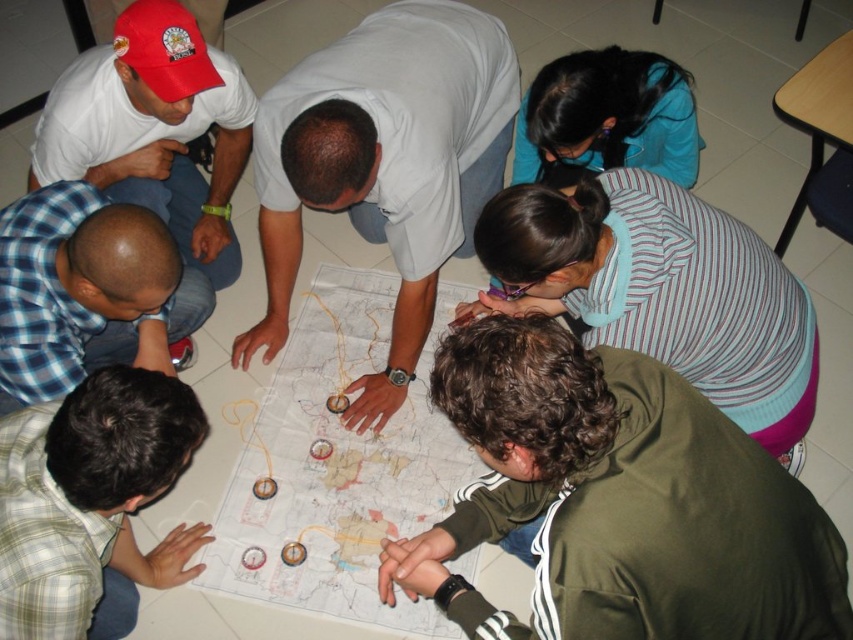
You are a photographer standing at the entrance of the room. You want to take a photo of the gray smooth shirt at center and the striped fabric shirt at lower center. Based on their sizes, which one should you focus on first to ensure both are clearly visible in the frame?

The gray smooth shirt at center is bigger than striped fabric shirt at lower center, so you should focus on the gray smooth shirt at center first to ensure both are clearly visible in the frame.

You are standing in the room where the group is gathered around the map. You need to locate the gray smooth shirt at center and the green plaid shirt at lower left. Which one is positioned higher up in the image?

The gray smooth shirt at center is located above the green plaid shirt at lower left, so it is positioned higher up in the image.

You are a person standing at the gray smooth shirt at center. You want to reach the nearest exit door which is 5 feet away from you. Can you walk directly to the exit without stepping over any other people?

The gray smooth shirt at center is 4.46 feet away from the nearest person. Since the exit is 5 feet away, you can walk directly to the exit without stepping over any other people because the distance between you and the nearest person is sufficient to move freely.